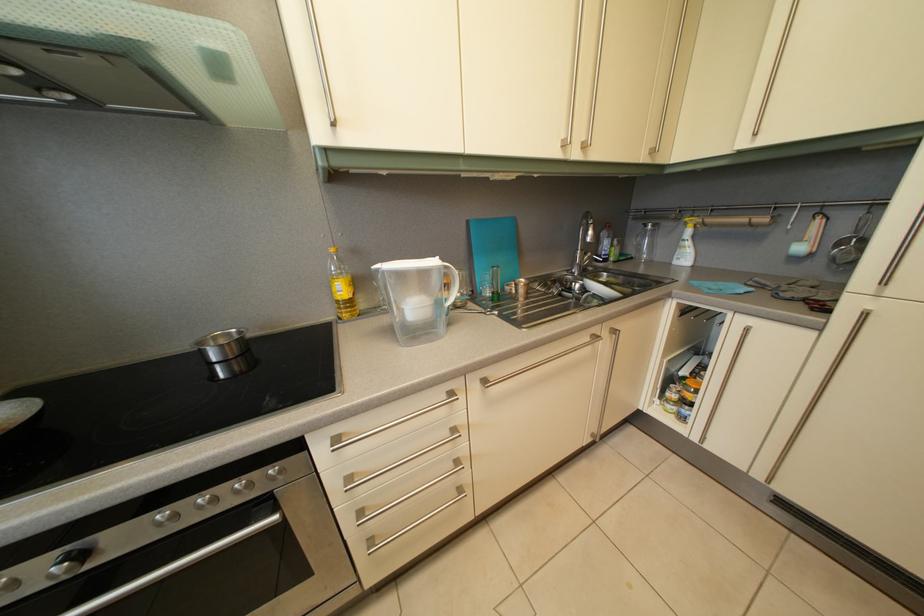
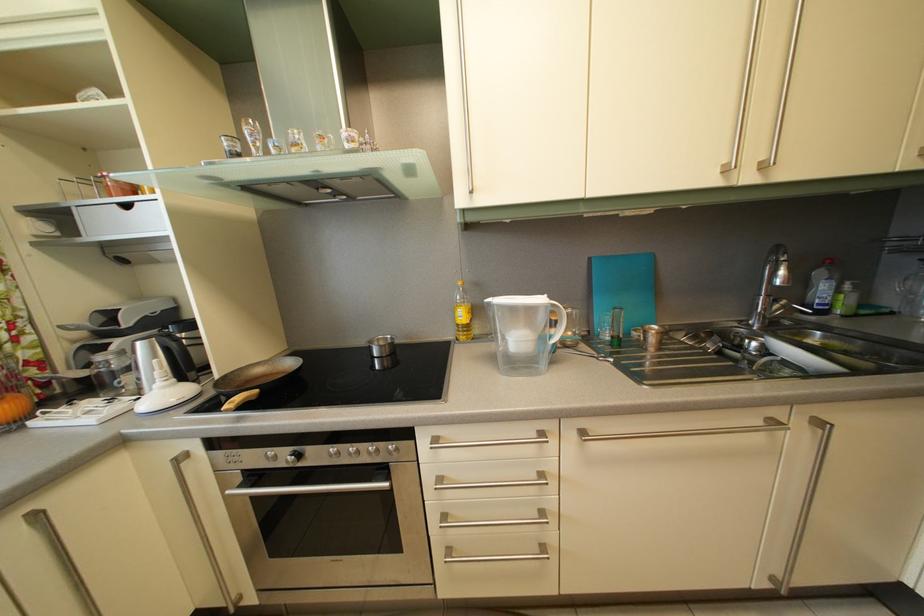
Which direction would the cameraman need to move to produce the second image?

The cameraman moved toward right, backward.